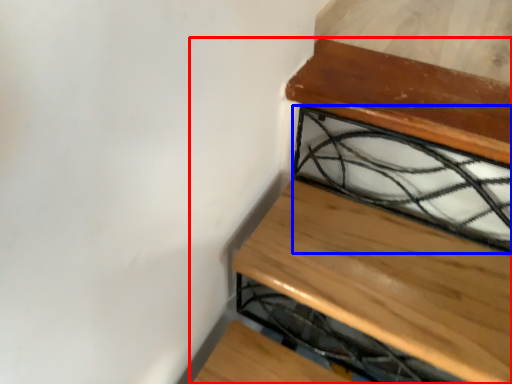
Question: Which object appears closest to the camera in this image, furniture (highlighted by a red box) or glass window (highlighted by a blue box)?

Choices:
 (A) furniture
 (B) glass window

Answer: (A)